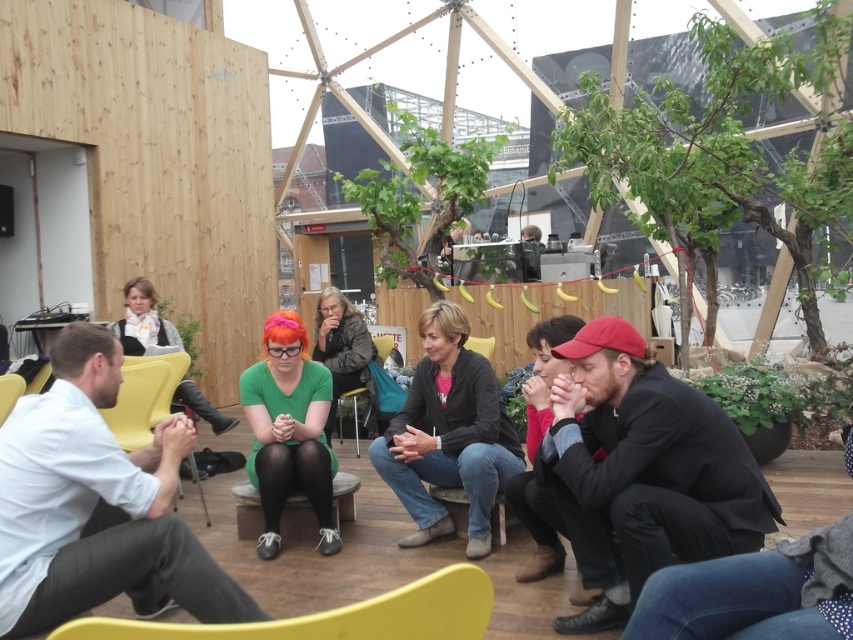
Question: Which of these objects is positioned closest to the green fabric chair at center?

Choices:
 (A) yellow plastic chair at lower left
 (B) denim jeans at center
 (C) light blue shirt at left

Answer: (B)

Question: Is yellow plastic chair at lower left above green fabric chair at center?

Choices:
 (A) yes
 (B) no

Answer: (A)

Question: Which point appears closest to the camera in this image?

Choices:
 (A) (450, 460)
 (B) (450, 611)

Answer: (B)

Question: Is denim jeans at center thinner than yellow plastic chair at lower left?

Choices:
 (A) no
 (B) yes

Answer: (B)

Question: Estimate the real-world distances between objects in this image. Which object is farther from the denim jeans at center?

Choices:
 (A) light blue shirt at left
 (B) green fabric chair at center
 (C) yellow plastic chair at lower left

Answer: (C)

Question: Where is light blue shirt at left located in relation to green fabric chair at center in the image?

Choices:
 (A) right
 (B) left

Answer: (B)